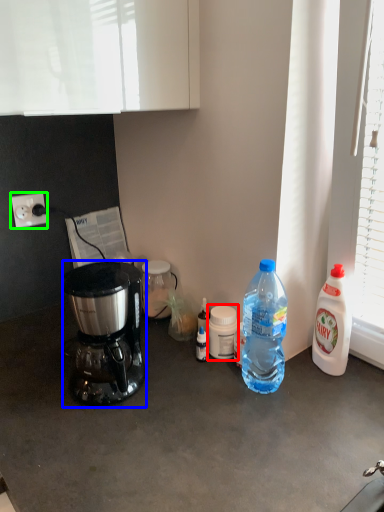
Question: Based on their relative distances, which object is nearer to bottle (highlighted by a red box)? Choose from coffee maker (highlighted by a blue box) and power outlet (highlighted by a green box).

Choices:
 (A) coffee maker
 (B) power outlet

Answer: (A)